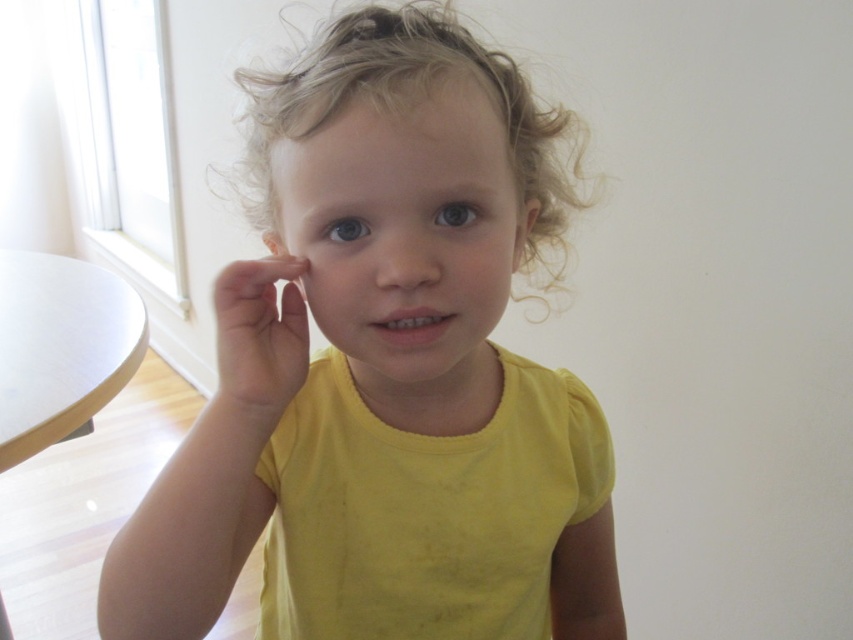
Who is more forward, (202, 426) or (120, 298)?

Positioned in front is point (202, 426).

Find the location of a particular element. yellow matte shirt at center is located at coordinates (347, 285).

Which is in front, point (151, 540) or point (376, 100)?

Positioned in front is point (376, 100).

The width and height of the screenshot is (853, 640). In order to click on yellow matte shirt at center in this screenshot , I will do `click(347, 285)`.

Does curly blonde hair at center appear on the right side of white matte table at left?

Correct, you'll find curly blonde hair at center to the right of white matte table at left.

Is point (540, 195) positioned before point (115, 376)?

Yes, point (540, 195) is in front of point (115, 376).

This screenshot has width=853, height=640. What are the coordinates of `curly blonde hair at center` in the screenshot? It's located at coord(410,108).